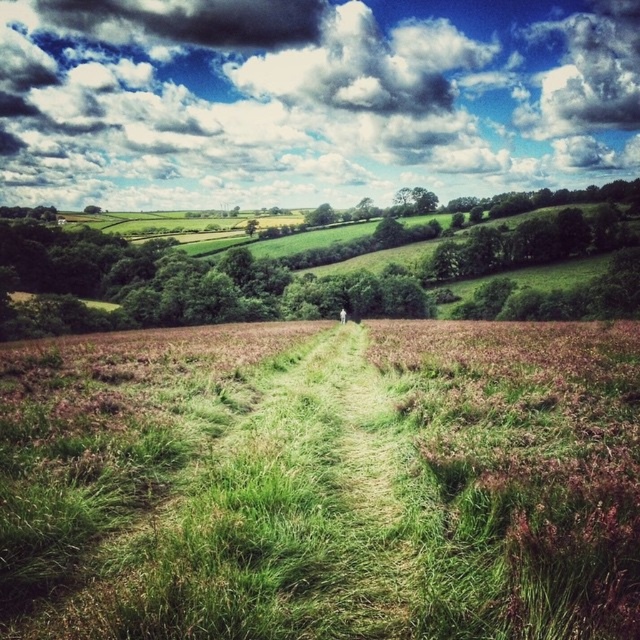
You are standing on the grassy path in the rural landscape. You see the cloudy sky at upper center and the white fabric person at center. Which object is higher in the scene?

The cloudy sky at upper center is taller than the white fabric person at center, so the cloudy sky at upper center is higher in the scene.

You are standing at the end of the grassy path in the rural landscape. You see the cloudy sky at upper center and the white fabric person at center. Which object is closer to you?

The cloudy sky at upper center is closer to you because the white fabric person at center is behind it.

Based on the photo, you are standing at the starting point of the grassy path in the image. If you walk straight ahead along the green grassy path at center, where will you end up?

You will end up at the point located at coordinates approximately (323, 483) along the green grassy path at center.